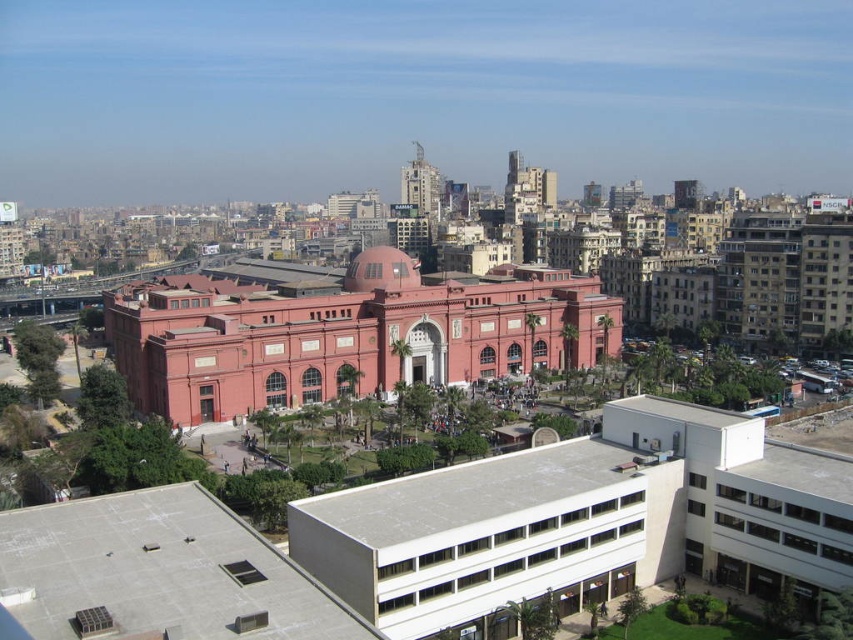
You are a city planner assessing the layout of this area. You need to install a new streetlight that must be equidistant from both the matte red building at center and the matte red dome at center. Given the distance between them, what is the minimum distance the streetlight should be placed from each structure to achieve this?

The streetlight should be placed exactly halfway between the matte red building at center and the matte red dome at center. Since they are 58.13 feet apart, the minimum distance from each would be 58.13 divided by 2, which is 29.065 feet.

You are an architect analyzing the cityscape. You notice the matte red building at center and the matte red dome at center. Which structure has a greater height?

The matte red building at center is taller than the matte red dome at center.